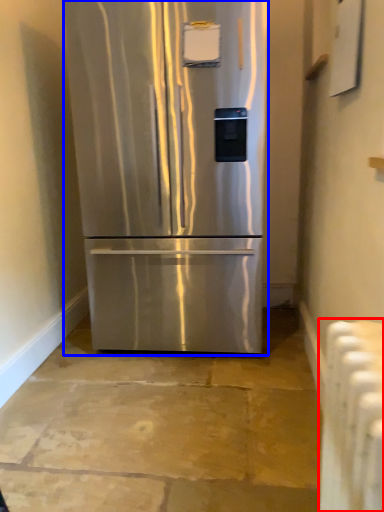
Question: Which object is closer to the camera taking this photo, radiator (highlighted by a red box) or refrigerator (highlighted by a blue box)?

Choices:
 (A) radiator
 (B) refrigerator

Answer: (A)